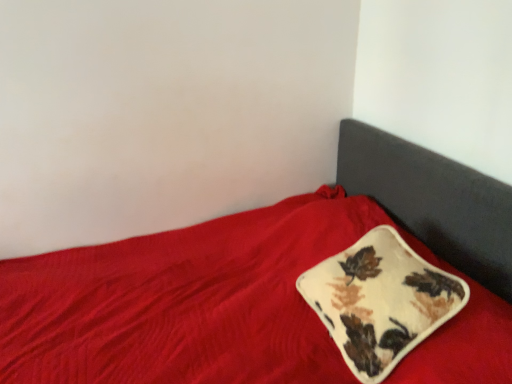
Question: In which direction should I rotate to look at velvety cream pillow with autumn leaves at center?

Choices:
 (A) left
 (B) right

Answer: (B)

Question: Is velvet red bed at center facing away from velvety cream pillow with autumn leaves at center?

Choices:
 (A) yes
 (B) no

Answer: (A)

Question: From the image's perspective, is velvet red bed at center located beneath velvety cream pillow with autumn leaves at center?

Choices:
 (A) yes
 (B) no

Answer: (A)

Question: Is velvet red bed at center at the left side of velvety cream pillow with autumn leaves at center?

Choices:
 (A) yes
 (B) no

Answer: (A)

Question: Is velvet red bed at center wider than velvety cream pillow with autumn leaves at center?

Choices:
 (A) yes
 (B) no

Answer: (A)

Question: Is velvet red bed at center smaller than velvety cream pillow with autumn leaves at center?

Choices:
 (A) no
 (B) yes

Answer: (A)

Question: Is velvety cream pillow with autumn leaves at center completely or partially inside velvet red bed at center?

Choices:
 (A) no
 (B) yes

Answer: (B)

Question: From the image's perspective, would you say velvety cream pillow with autumn leaves at center is positioned over velvet red bed at center?

Choices:
 (A) no
 (B) yes

Answer: (B)

Question: Is velvety cream pillow with autumn leaves at center with velvet red bed at center?

Choices:
 (A) yes
 (B) no

Answer: (B)

Question: Considering the relative sizes of velvety cream pillow with autumn leaves at center and velvet red bed at center in the image provided, is velvety cream pillow with autumn leaves at center taller than velvet red bed at center?

Choices:
 (A) yes
 (B) no

Answer: (B)

Question: Is velvety cream pillow with autumn leaves at center surrounding velvet red bed at center?

Choices:
 (A) no
 (B) yes

Answer: (A)

Question: Is velvety cream pillow with autumn leaves at center aimed at velvet red bed at center?

Choices:
 (A) yes
 (B) no

Answer: (A)

Question: Considering the relative sizes of velvety cream pillow with autumn leaves at center and velvet red bed at center in the image provided, is velvety cream pillow with autumn leaves at center shorter than velvet red bed at center?

Choices:
 (A) no
 (B) yes

Answer: (B)

Question: Based on their sizes in the image, would you say velvety cream pillow with autumn leaves at center is bigger or smaller than velvet red bed at center?

Choices:
 (A) big
 (B) small

Answer: (B)